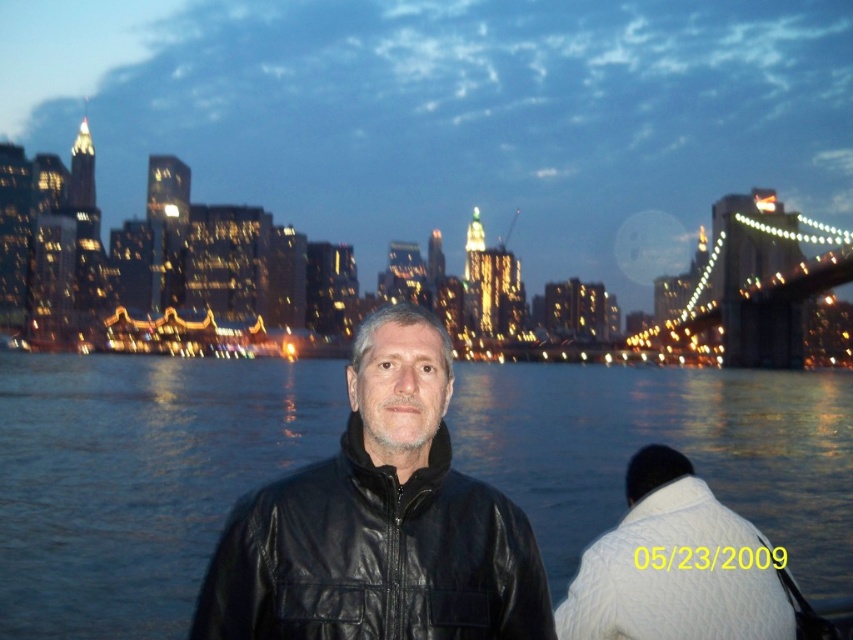
Who is higher up, black leather jacket at center or metallic illuminated bridge at right?

Positioned higher is metallic illuminated bridge at right.

Can you confirm if black leather jacket at center is taller than metallic illuminated bridge at right?

No.

Where is `black leather jacket at center`? This screenshot has height=640, width=853. black leather jacket at center is located at coordinates (x=379, y=522).

I want to click on black leather jacket at center, so click(x=379, y=522).

Can you confirm if blue water at center is positioned above metallic illuminated bridge at right?

Actually, blue water at center is below metallic illuminated bridge at right.

Who is more forward, (822,476) or (799,292)?

Point (822,476)

Who is more forward, (553,371) or (763,339)?

Point (763,339) is more forward.

Locate an element on the screen. This screenshot has width=853, height=640. blue water at center is located at coordinates (138, 480).

Can you confirm if blue water at center is bigger than black leather jacket at center?

Yes.

Between point (4, 449) and point (351, 477), which one is positioned in front?

Positioned in front is point (351, 477).

You are a GUI agent. You are given a task and a screenshot of the screen. Output one action in this format:
    pyautogui.click(x=<x>, y=<y>)
    Task: Click on the blue water at center
    
    Given the screenshot: What is the action you would take?
    pyautogui.click(x=138, y=480)

Where is `blue water at center`? Image resolution: width=853 pixels, height=640 pixels. blue water at center is located at coordinates (138, 480).